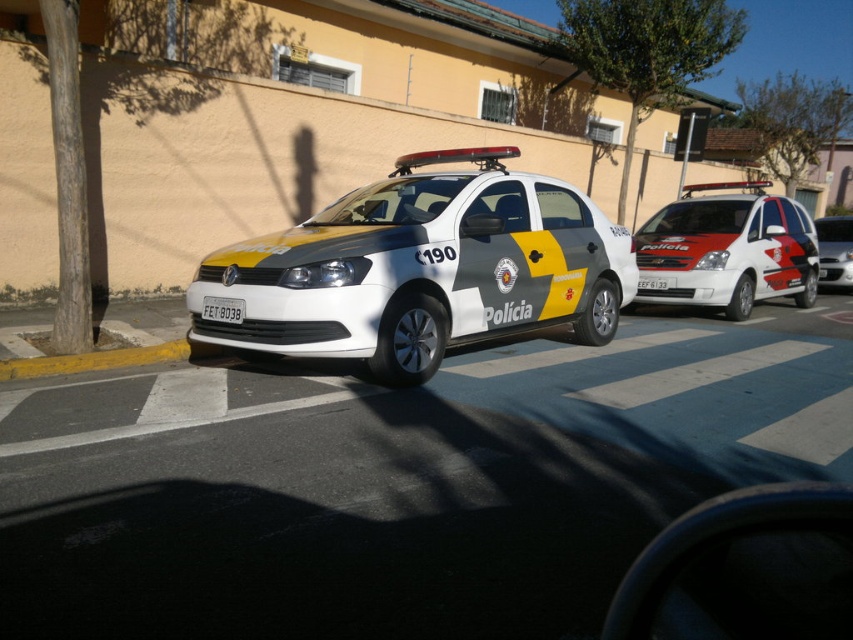
Is point (334, 349) positioned behind point (831, 234)?

No, it is not.

Does white glossy police car at center have a lesser height compared to white glossy van at center?

No, white glossy police car at center is not shorter than white glossy van at center.

Is point (364, 243) in front of point (828, 237)?

Yes, it is.

Find the location of `white glossy police car at center`. white glossy police car at center is located at coordinates (422, 268).

Is white glossy police car at center thinner than white plastic license plate at center?

No, white glossy police car at center is not thinner than white plastic license plate at center.

Is white glossy police car at center smaller than white plastic license plate at center?

Actually, white glossy police car at center might be larger than white plastic license plate at center.

What do you see at coordinates (422, 268) in the screenshot? I see `white glossy police car at center` at bounding box center [422, 268].

In order to click on white glossy police car at center in this screenshot , I will do `click(422, 268)`.

Is white glossy van at right taller than white plastic license plate at center?

Yes, white glossy van at right is taller than white plastic license plate at center.

What do you see at coordinates (727, 250) in the screenshot?
I see `white glossy van at right` at bounding box center [727, 250].

Is point (717, 195) positioned behind point (219, 320)?

Yes.

Where is `white glossy van at right`? The image size is (853, 640). white glossy van at right is located at coordinates (727, 250).